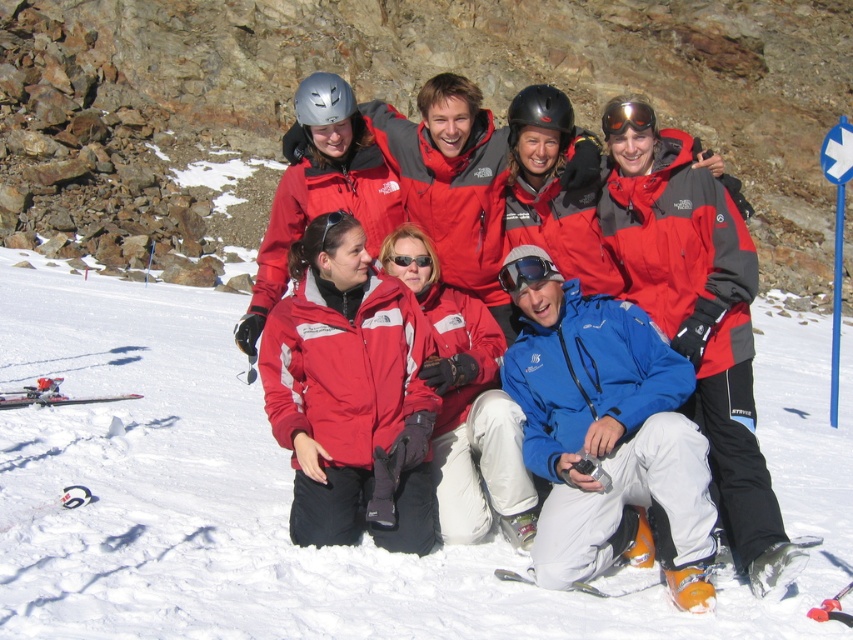
You are a photographer standing at the camera position. You want to focus on the two points in the image labeled as point (24, 404) and point (648, 124). Which point is closer to your camera?

Point (24, 404) is closer to the camera than point (648, 124).

In the image of the group on the snowy slope, there is a point at coordinate [350,394]. Which object from the list corresponds to this point?

The point at coordinate [350,394] corresponds to the matte red jacket at center.